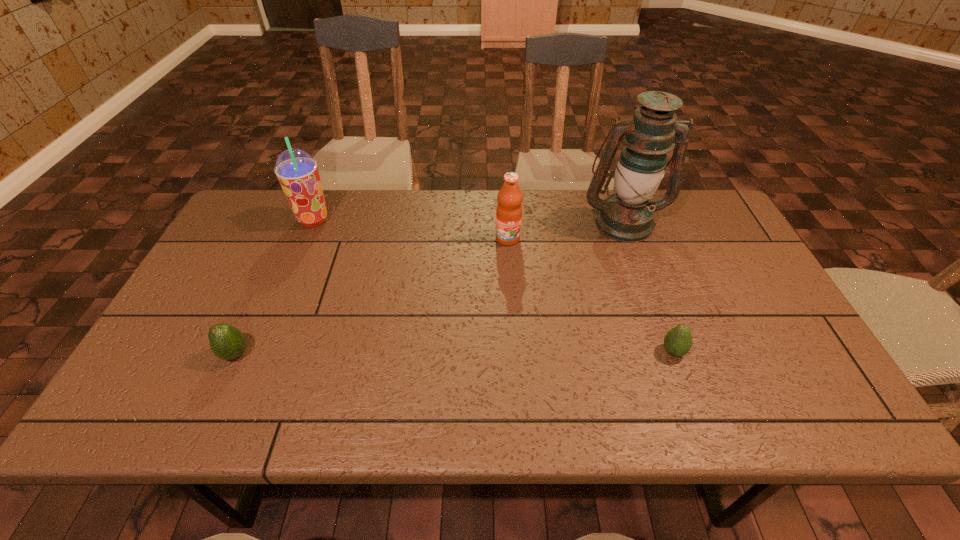
In order to click on free region located on the front of the right avocado in this screenshot , I will do `click(696, 415)`.

This screenshot has width=960, height=540. In order to click on oil lamp that is at the far edge in this screenshot , I will do `click(626, 215)`.

Find the location of a particular element. smoothie that is at the far edge is located at coordinates (297, 172).

Image resolution: width=960 pixels, height=540 pixels. Identify the location of fruit juice at the far edge. (509, 209).

I want to click on object that is at the left edge, so click(x=226, y=342).

At what (x,y) coordinates should I click in order to perform the action: click on vacant area at the far edge. Please return your answer as a coordinate pair (x, y). The height and width of the screenshot is (540, 960). Looking at the image, I should click on (396, 225).

You are a GUI agent. You are given a task and a screenshot of the screen. Output one action in this format:
    pyautogui.click(x=<x>, y=<y>)
    Task: Click on the free space at the near edge of the desktop
    The height and width of the screenshot is (540, 960).
    Given the screenshot: What is the action you would take?
    pyautogui.click(x=672, y=421)

Locate an element on the screen. This screenshot has width=960, height=540. vacant region at the left edge of the desktop is located at coordinates (204, 364).

Locate an element on the screen. Image resolution: width=960 pixels, height=540 pixels. vacant space at the right edge of the desktop is located at coordinates (708, 251).

You are a GUI agent. You are given a task and a screenshot of the screen. Output one action in this format:
    pyautogui.click(x=<x>, y=<y>)
    Task: Click on the vacant space at the far right corner of the desktop
    This screenshot has width=960, height=540.
    Given the screenshot: What is the action you would take?
    pyautogui.click(x=710, y=197)